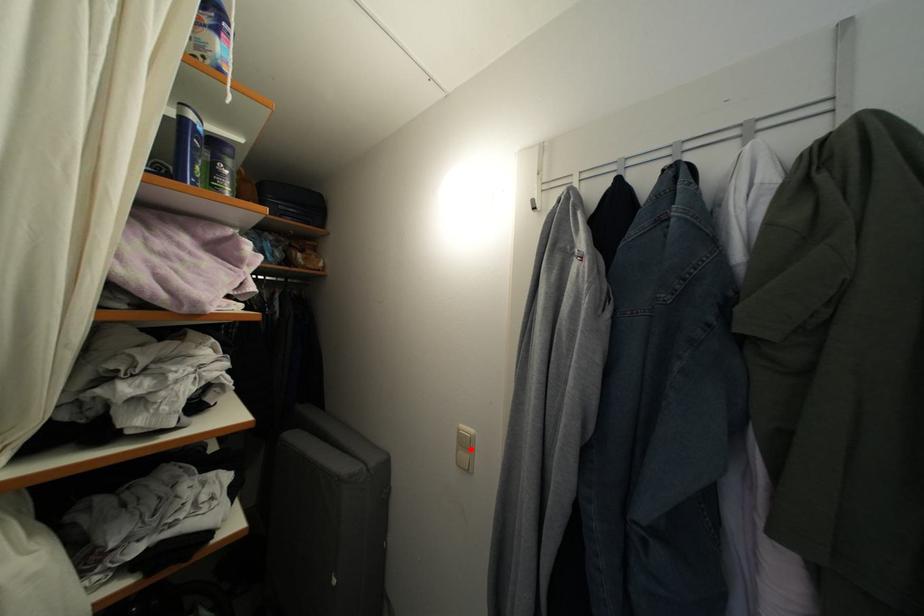
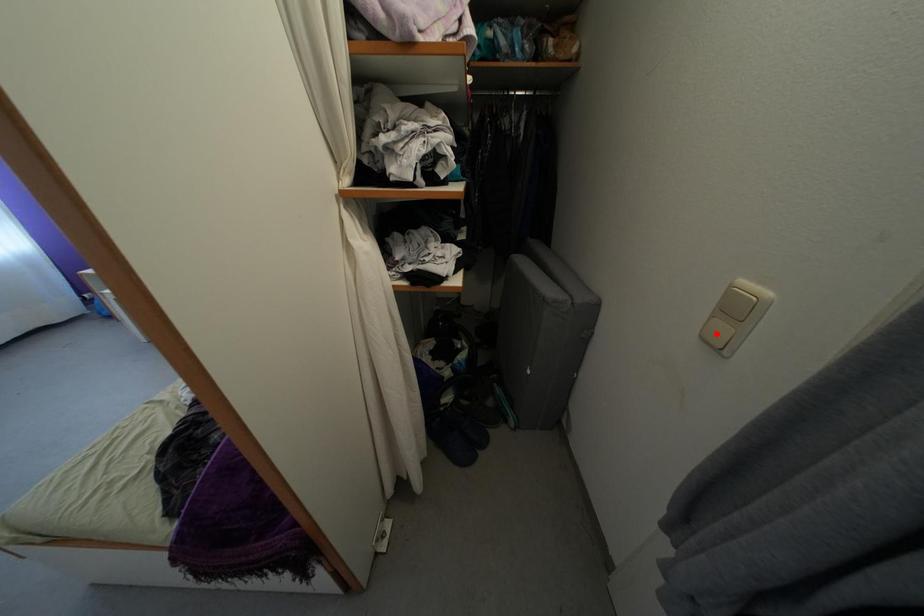
I am providing you with two images of the same scene from different viewpoints. A red point is marked on the first image and another point is marked on the second image. Do the highlighted points in image1 and image2 indicate the same real-world spot?

No